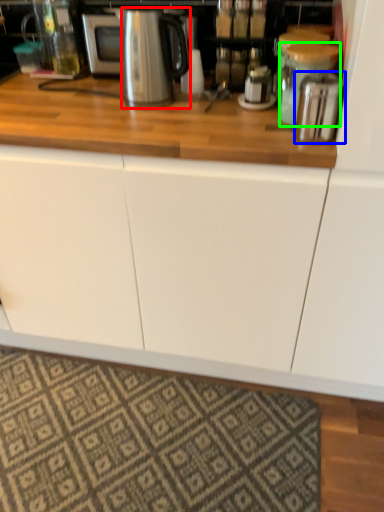
Question: Which object is positioned closest to kitchen appliance (highlighted by a red box)? Select from appliance (highlighted by a blue box) and appliance (highlighted by a green box).

Choices:
 (A) appliance
 (B) appliance

Answer: (B)